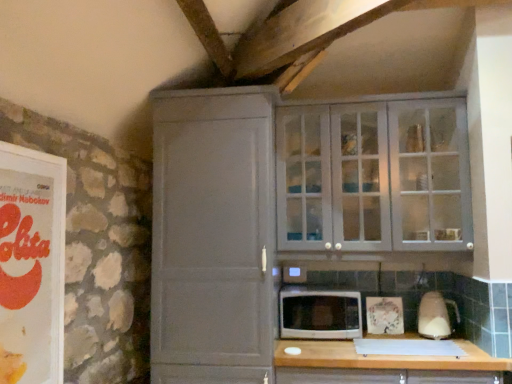
Question: Considering the relative positions of matte orange book at left and white glossy microwave at center in the image provided, is matte orange book at left to the right of white glossy microwave at center from the viewer's perspective?

Choices:
 (A) no
 (B) yes

Answer: (A)

Question: From the image's perspective, is matte orange book at left located beneath white glossy microwave at center?

Choices:
 (A) no
 (B) yes

Answer: (A)

Question: Can you confirm if matte orange book at left is taller than white glossy microwave at center?

Choices:
 (A) yes
 (B) no

Answer: (A)

Question: Considering the relative positions of matte orange book at left and white glossy microwave at center in the image provided, is matte orange book at left in front of white glossy microwave at center?

Choices:
 (A) yes
 (B) no

Answer: (A)

Question: Is white glossy microwave at center surrounded by matte orange book at left?

Choices:
 (A) yes
 (B) no

Answer: (B)

Question: Does matte orange book at left turn towards white glossy microwave at center?

Choices:
 (A) yes
 (B) no

Answer: (B)

Question: Is matte gray cabinet at center, which ranks as the first cupboard in left-to-right order, closer to the viewer compared to matte gray cabinet at upper right, which appears as the second cupboard when viewed from the left?

Choices:
 (A) no
 (B) yes

Answer: (B)

Question: Can you confirm if matte gray cabinet at center, which ranks as the first cupboard in left-to-right order, is positioned to the left of matte gray cabinet at upper right, which appears as the second cupboard when viewed from the left?

Choices:
 (A) yes
 (B) no

Answer: (A)

Question: Does matte gray cabinet at center, which is the 2th cupboard from right to left, have a smaller size compared to matte gray cabinet at upper right, which appears as the 1th cupboard when viewed from the right?

Choices:
 (A) yes
 (B) no

Answer: (B)

Question: Is matte gray cabinet at center, which ranks as the first cupboard in left-to-right order, outside matte gray cabinet at upper right, which appears as the 1th cupboard when viewed from the right?

Choices:
 (A) yes
 (B) no

Answer: (A)

Question: Does matte gray cabinet at center, which is the 2th cupboard from right to left, have a greater width compared to matte gray cabinet at upper right, which appears as the second cupboard when viewed from the left?

Choices:
 (A) yes
 (B) no

Answer: (A)

Question: From the image's perspective, is matte gray cabinet at center, which is the 2th cupboard from right to left, beneath matte gray cabinet at upper right, which appears as the second cupboard when viewed from the left?

Choices:
 (A) no
 (B) yes

Answer: (B)

Question: Considering the relative positions of white glossy microwave at center and matte orange book at left in the image provided, is white glossy microwave at center to the right of matte orange book at left from the viewer's perspective?

Choices:
 (A) yes
 (B) no

Answer: (A)